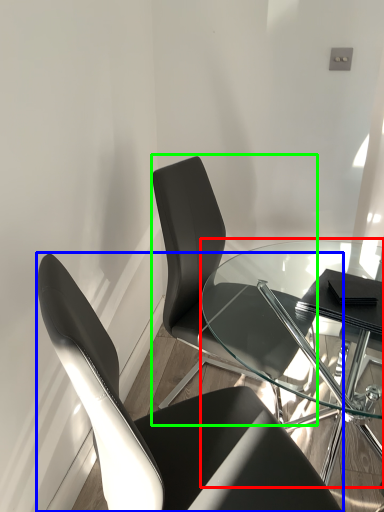
Question: Considering the real-world distances, which object is closest to table (highlighted by a red box)? chair (highlighted by a blue box) or chair (highlighted by a green box).

Choices:
 (A) chair
 (B) chair

Answer: (B)